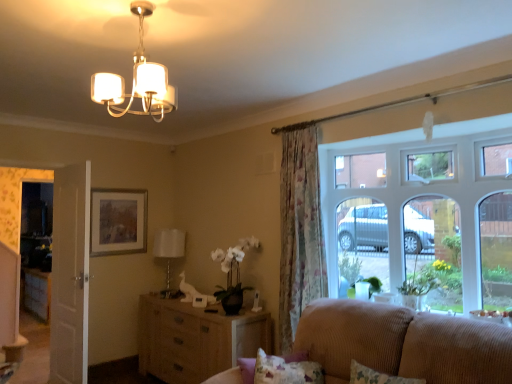
Question: Considering the relative positions of white wooden door at left and wooden picture frame at upper left in the image provided, is white wooden door at left behind wooden picture frame at upper left?

Choices:
 (A) no
 (B) yes

Answer: (A)

Question: From a real-world perspective, is white wooden door at left positioned under wooden picture frame at upper left based on gravity?

Choices:
 (A) no
 (B) yes

Answer: (B)

Question: Is white wooden door at left positioned far away from wooden picture frame at upper left?

Choices:
 (A) yes
 (B) no

Answer: (B)

Question: Is white wooden door at left bigger than wooden picture frame at upper left?

Choices:
 (A) no
 (B) yes

Answer: (B)

Question: Does white wooden door at left have a greater height compared to wooden picture frame at upper left?

Choices:
 (A) no
 (B) yes

Answer: (B)

Question: From the image's perspective, relative to white wooden door at left, is wooden picture frame at upper left above or below?

Choices:
 (A) above
 (B) below

Answer: (A)

Question: Does point (142, 201) appear closer or farther from the camera than point (80, 365)?

Choices:
 (A) farther
 (B) closer

Answer: (A)

Question: In terms of width, does wooden picture frame at upper left look wider or thinner when compared to white wooden door at left?

Choices:
 (A) thin
 (B) wide

Answer: (A)

Question: Is wooden picture frame at upper left spatially inside white wooden door at left, or outside of it?

Choices:
 (A) outside
 (B) inside

Answer: (A)

Question: From a real-world perspective, is fluffy fabric pillow at lower right positioned above or below matte white chandelier at upper center, placed as the first lamp when sorted from front to back?

Choices:
 (A) below
 (B) above

Answer: (A)

Question: From the image's perspective, is fluffy fabric pillow at lower right located above or below matte white chandelier at upper center, the 2th lamp in the left-to-right sequence?

Choices:
 (A) below
 (B) above

Answer: (A)

Question: Considering the positions of fluffy fabric pillow at lower right and matte white chandelier at upper center, the first lamp viewed from the top, in the image, is fluffy fabric pillow at lower right wider or thinner than matte white chandelier at upper center, the first lamp viewed from the top,?

Choices:
 (A) wide
 (B) thin

Answer: (B)

Question: In the image, is fluffy fabric pillow at lower right positioned in front of or behind matte white chandelier at upper center, placed as the first lamp when sorted from front to back?

Choices:
 (A) behind
 (B) front

Answer: (A)

Question: From a real-world perspective, is transparent glass door at left above or below woven wood dresser at center?

Choices:
 (A) below
 (B) above

Answer: (B)

Question: Visually, is transparent glass door at left positioned to the left or to the right of woven wood dresser at center?

Choices:
 (A) left
 (B) right

Answer: (A)